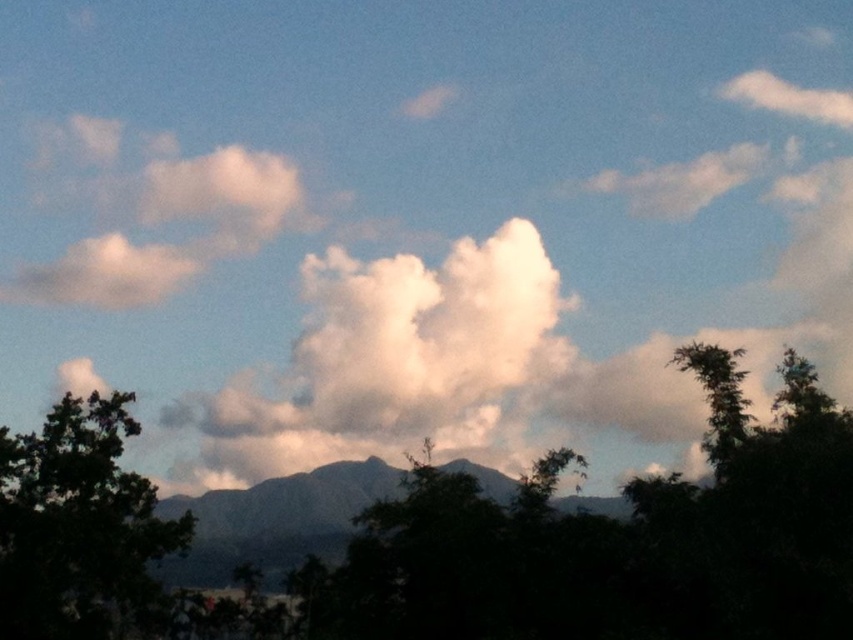
Question: Is dark green leafy tree at lower left thinner than gray matte mountain at center?

Choices:
 (A) no
 (B) yes

Answer: (B)

Question: Which point is closer to the camera?

Choices:
 (A) green leafy tree at right
 (B) gray matte mountain at center

Answer: (A)

Question: Considering the real-world distances, which object is farthest from the green leafy tree at right?

Choices:
 (A) gray matte mountain at center
 (B) dark green leafy tree at lower left

Answer: (B)

Question: Is dark green leafy tree at lower left above gray matte mountain at center?

Choices:
 (A) no
 (B) yes

Answer: (B)

Question: Does dark green leafy tree at lower left come in front of green leafy tree at right?

Choices:
 (A) no
 (B) yes

Answer: (B)

Question: Which point is closer to the camera taking this photo?

Choices:
 (A) (61, 588)
 (B) (712, 356)
 (C) (242, 509)

Answer: (A)